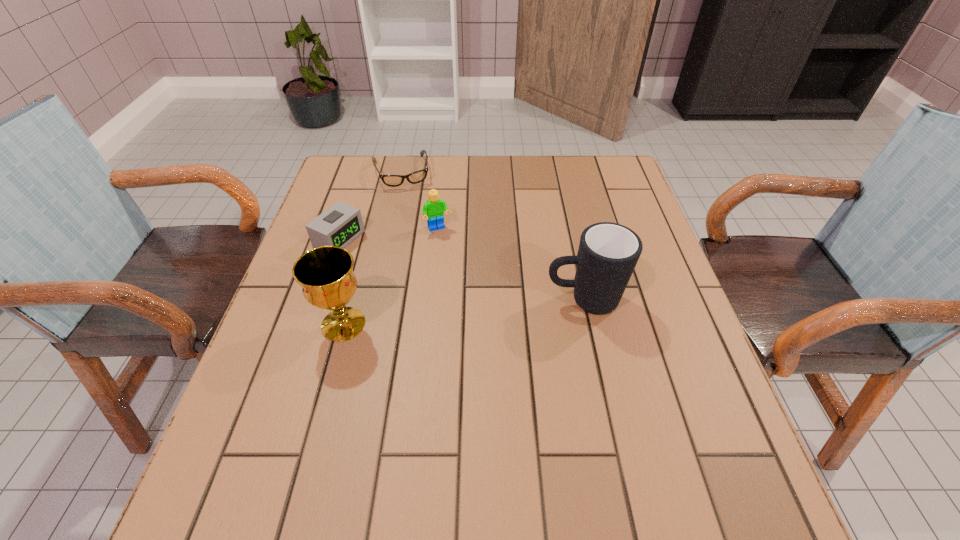
Identify the location of vacant space on the desktop that is between the chalice and the mug and is positioned on the face of the third shortest object. (477, 310).

This screenshot has height=540, width=960. Identify the location of vacant space on the desktop that is between the chalice and the rightmost object and is positioned on the front-facing side of the fourth tallest object. (492, 309).

Where is `vacant spot on the desktop that is between the chalice and the rightmost object and is positioned on the front-facing side of the shortest object`? This screenshot has width=960, height=540. vacant spot on the desktop that is between the chalice and the rightmost object and is positioned on the front-facing side of the shortest object is located at coordinates (440, 314).